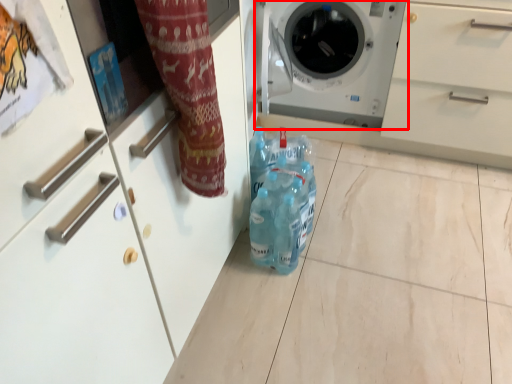
Question: Observing the image, what is the correct spatial positioning of washing machine (annotated by the red box) in reference to cleaning product?

Choices:
 (A) left
 (B) right

Answer: (B)